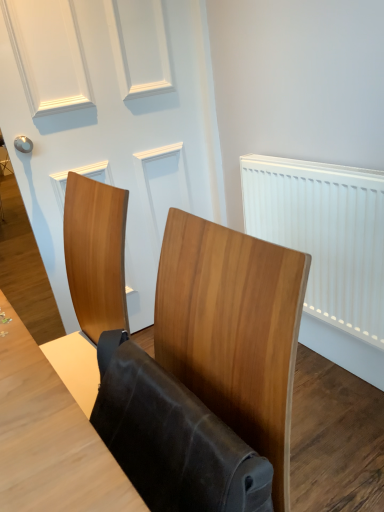
Question: Considering the relative sizes of white matte door at upper center and leather-like brown folding chair at center in the image provided, is white matte door at upper center thinner than leather-like brown folding chair at center?

Choices:
 (A) yes
 (B) no

Answer: (B)

Question: From a real-world perspective, does white matte door at upper center sit lower than leather-like brown folding chair at center?

Choices:
 (A) yes
 (B) no

Answer: (B)

Question: Does white matte door at upper center have a larger size compared to leather-like brown folding chair at center?

Choices:
 (A) no
 (B) yes

Answer: (B)

Question: Does white matte door at upper center have a smaller size compared to leather-like brown folding chair at center?

Choices:
 (A) no
 (B) yes

Answer: (A)

Question: Does white matte door at upper center have a greater width compared to leather-like brown folding chair at center?

Choices:
 (A) yes
 (B) no

Answer: (A)

Question: Visually, is leather-like brown folding chair at center positioned to the left or to the right of wooden chair at center?

Choices:
 (A) left
 (B) right

Answer: (B)

Question: Is leather-like brown folding chair at center taller or shorter than wooden chair at center?

Choices:
 (A) tall
 (B) short

Answer: (B)

Question: Considering the positions of point (173, 496) and point (205, 245), is point (173, 496) closer or farther from the camera than point (205, 245)?

Choices:
 (A) farther
 (B) closer

Answer: (B)

Question: From the image's perspective, is leather-like brown folding chair at center positioned above or below wooden chair at center?

Choices:
 (A) above
 (B) below

Answer: (A)

Question: Considering the positions of leather-like brown folding chair at center and white plastic radiator at right in the image, is leather-like brown folding chair at center wider or thinner than white plastic radiator at right?

Choices:
 (A) wide
 (B) thin

Answer: (A)

Question: Is point (206, 424) closer or farther from the camera than point (301, 211)?

Choices:
 (A) closer
 (B) farther

Answer: (A)

Question: In terms of size, does leather-like brown folding chair at center appear bigger or smaller than white plastic radiator at right?

Choices:
 (A) small
 (B) big

Answer: (A)

Question: Is leather-like brown folding chair at center in front of or behind white plastic radiator at right in the image?

Choices:
 (A) behind
 (B) front

Answer: (B)

Question: From a real-world perspective, is wooden chair at center positioned above or below white plastic radiator at right?

Choices:
 (A) below
 (B) above

Answer: (B)

Question: Is wooden chair at center bigger or smaller than white plastic radiator at right?

Choices:
 (A) big
 (B) small

Answer: (A)